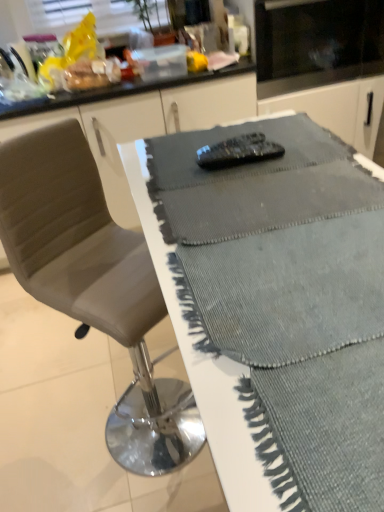
Question: Is textured gray table at center turned away from black glass microwave at upper center?

Choices:
 (A) yes
 (B) no

Answer: (B)

Question: Is textured gray table at center thinner than black glass microwave at upper center?

Choices:
 (A) yes
 (B) no

Answer: (A)

Question: Is textured gray table at center positioned far away from black glass microwave at upper center?

Choices:
 (A) no
 (B) yes

Answer: (B)

Question: From the image's perspective, is textured gray table at center beneath black glass microwave at upper center?

Choices:
 (A) no
 (B) yes

Answer: (B)

Question: From a real-world perspective, is textured gray table at center positioned under black glass microwave at upper center based on gravity?

Choices:
 (A) no
 (B) yes

Answer: (A)

Question: Does textured gray table at center have a greater width compared to black glass microwave at upper center?

Choices:
 (A) yes
 (B) no

Answer: (B)

Question: Are textured gray table at center and leather-like gray chair at center far apart?

Choices:
 (A) yes
 (B) no

Answer: (B)

Question: Is textured gray table at center further to the viewer compared to leather-like gray chair at center?

Choices:
 (A) yes
 (B) no

Answer: (B)

Question: Is textured gray table at center closer to the viewer compared to leather-like gray chair at center?

Choices:
 (A) no
 (B) yes

Answer: (B)

Question: Does textured gray table at center have a smaller size compared to leather-like gray chair at center?

Choices:
 (A) yes
 (B) no

Answer: (A)

Question: From the image's perspective, is textured gray table at center on top of leather-like gray chair at center?

Choices:
 (A) no
 (B) yes

Answer: (B)

Question: From the image's perspective, is textured gray table at center beneath leather-like gray chair at center?

Choices:
 (A) yes
 (B) no

Answer: (B)

Question: From the image's perspective, is leather-like gray chair at center on black glass microwave at upper center?

Choices:
 (A) no
 (B) yes

Answer: (A)